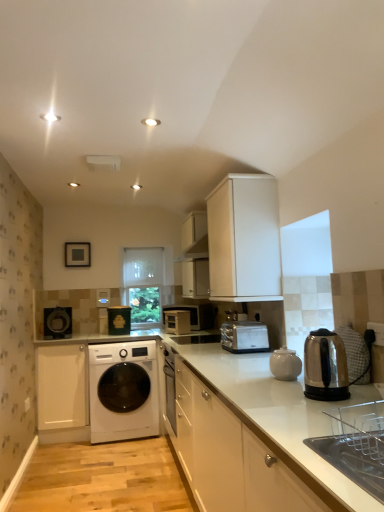
You are a GUI agent. You are given a task and a screenshot of the screen. Output one action in this format:
    pyautogui.click(x=<x>, y=<y>)
    Task: Click on the white matte cabinet at lower left, the 4th cabinetry from the right
    Image resolution: width=384 pixels, height=512 pixels.
    Given the screenshot: What is the action you would take?
    pyautogui.click(x=61, y=386)

The height and width of the screenshot is (512, 384). Describe the element at coordinates (119, 320) in the screenshot. I see `matte black toaster at center, which is the 2th appliance from right to left` at that location.

Describe the element at coordinates (177, 322) in the screenshot. Image resolution: width=384 pixels, height=512 pixels. I see `metallic silver toaster at center, which is counted as the 3th appliance, starting from the left` at that location.

Where is `white glossy washing machine at lower left`? white glossy washing machine at lower left is located at coordinates (123, 391).

The height and width of the screenshot is (512, 384). I want to click on white matte cabinet at lower left, the 4th cabinetry from the right, so click(x=61, y=386).

Between point (146, 248) and point (227, 327), which one is positioned in front?

The point (227, 327) is in front.

From the image's perspective, is transparent plastic window screen at center, placed as the first window screen when sorted from top to bottom, positioned above or below satin silver toaster at center, which appears as the first home appliance when viewed from the back?

Clearly, from the image's perspective, transparent plastic window screen at center, placed as the first window screen when sorted from top to bottom, is above satin silver toaster at center, which appears as the first home appliance when viewed from the back.

From the image's perspective, count 2nd window screens upward from the satin silver toaster at center, the 2th home appliance when ordered from front to back, and point to it. Please provide its 2D coordinates.

[(143, 266)]

Considering the relative positions of transparent plastic window screen at center, the 2th window screen in the bottom-to-top sequence, and satin silver toaster at center, the 2th home appliance when ordered from front to back, in the image provided, is transparent plastic window screen at center, the 2th window screen in the bottom-to-top sequence, to the left of satin silver toaster at center, the 2th home appliance when ordered from front to back, from the viewer's perspective?

Correct, you'll find transparent plastic window screen at center, the 2th window screen in the bottom-to-top sequence, to the left of satin silver toaster at center, the 2th home appliance when ordered from front to back.

In the image, is transparent glass window at center, placed as the 1th window screen when sorted from bottom to top, on the left side or the right side of white glossy cabinet at center, placed as the 2th cabinetry when sorted from left to right?

In the image, transparent glass window at center, placed as the 1th window screen when sorted from bottom to top, appears on the left side of white glossy cabinet at center, placed as the 2th cabinetry when sorted from left to right.

Does point (149, 307) come farther from viewer compared to point (196, 497)?

That is True.

How much distance is there between transparent glass window at center, placed as the 1th window screen when sorted from bottom to top, and white glossy cabinet at center, placed as the 2th cabinetry when sorted from left to right?

2.61 meters.

Is matte black toaster at center, which is the 2th appliance from right to left, bigger or smaller than transparent glass window at center, which is the 2th window screen in top-to-bottom order?

Considering their sizes, matte black toaster at center, which is the 2th appliance from right to left, takes up less space than transparent glass window at center, which is the 2th window screen in top-to-bottom order.

Which is less distant, (116, 331) or (138, 250)?

Clearly, point (116, 331) is closer to the camera than point (138, 250).

Is matte black toaster at center, which is the 2th appliance from right to left, wider than transparent glass window at center, placed as the 1th window screen when sorted from bottom to top?

Yes, matte black toaster at center, which is the 2th appliance from right to left, is wider than transparent glass window at center, placed as the 1th window screen when sorted from bottom to top.

From a real-world perspective, does matte black toaster at center, the 2th appliance when ordered from left to right, stand above transparent glass window at center, which is the 2th window screen in top-to-bottom order?

No, from a real-world perspective, matte black toaster at center, the 2th appliance when ordered from left to right, is not above transparent glass window at center, which is the 2th window screen in top-to-bottom order.

Based on the photo, can you confirm if metallic silver toaster at center, the 1th appliance viewed from the right, is bigger than white glossy teapot at center?

Yes, metallic silver toaster at center, the 1th appliance viewed from the right, is bigger than white glossy teapot at center.

Based on their positions, is metallic silver toaster at center, which is counted as the 3th appliance, starting from the left, located to the left or right of white glossy teapot at center?

metallic silver toaster at center, which is counted as the 3th appliance, starting from the left, is to the left of white glossy teapot at center.

Considering the positions of points (167, 316) and (283, 349), is point (167, 316) farther from camera compared to point (283, 349)?

Yes, point (167, 316) is behind point (283, 349).

Can white glossy teapot at center be found inside metallic silver toaster at center, which is counted as the 3th appliance, starting from the left?

No, white glossy teapot at center is not a part of metallic silver toaster at center, which is counted as the 3th appliance, starting from the left.

Is stainless steel kettle at right, which appears as the second home appliance when viewed from the back, smaller than white matte cabinet at lower left, the 1th cabinetry viewed from the left?

Correct, stainless steel kettle at right, which appears as the second home appliance when viewed from the back, occupies less space than white matte cabinet at lower left, the 1th cabinetry viewed from the left.

How many degrees apart are the facing directions of stainless steel kettle at right, which appears as the second home appliance when viewed from the back, and white matte cabinet at lower left, the 1th cabinetry viewed from the left?

88.7 degrees separate the facing orientations of stainless steel kettle at right, which appears as the second home appliance when viewed from the back, and white matte cabinet at lower left, the 1th cabinetry viewed from the left.

Considering the relative sizes of stainless steel kettle at right, which appears as the second home appliance when viewed from the back, and white matte cabinet at lower left, the 1th cabinetry viewed from the left, in the image provided, is stainless steel kettle at right, which appears as the second home appliance when viewed from the back, thinner than white matte cabinet at lower left, the 1th cabinetry viewed from the left,?

Yes.

Are stainless steel kettle at right, which appears as the second home appliance when viewed from the back, and white matte cabinet at lower left, the 1th cabinetry viewed from the left, making contact?

stainless steel kettle at right, which appears as the second home appliance when viewed from the back, and white matte cabinet at lower left, the 1th cabinetry viewed from the left, are clearly separated.

Considering the relative sizes of white glossy cabinet at center, which is the first cabinetry from right to left, and white glossy cabinet at center, placed as the 2th cabinetry when sorted from left to right, in the image provided, is white glossy cabinet at center, which is the first cabinetry from right to left, smaller than white glossy cabinet at center, placed as the 2th cabinetry when sorted from left to right,?

Actually, white glossy cabinet at center, which is the first cabinetry from right to left, might be larger than white glossy cabinet at center, placed as the 2th cabinetry when sorted from left to right.

From the image's perspective, between white glossy cabinet at center, the fourth cabinetry when ordered from left to right, and white glossy cabinet at center, placed as the 2th cabinetry when sorted from left to right, which one is located above?

white glossy cabinet at center, the fourth cabinetry when ordered from left to right, from the image's perspective.

From the image's perspective, which is below, white matte cabinet at lower left, the 4th cabinetry from the right, or white matte cabinet at upper center, the 2th cabinetry from the right?

white matte cabinet at lower left, the 4th cabinetry from the right, is shown below in the image.

Which object is thinner, white matte cabinet at lower left, the 1th cabinetry viewed from the left, or white matte cabinet at upper center, the 2th cabinetry from the right?

white matte cabinet at upper center, the 2th cabinetry from the right, is thinner.

From the white matte cabinet at upper center, which is the third cabinetry from left to right, count the 2nd cabinetry to the left and point to it. Please provide its 2D coordinates.

[(61, 386)]

Which of these two, white matte cabinet at lower left, the 1th cabinetry viewed from the left, or white matte cabinet at upper center, which is the third cabinetry from left to right, stands shorter?

white matte cabinet at upper center, which is the third cabinetry from left to right, is shorter.

Starting from the satin silver toaster at center, which appears as the first home appliance when viewed from the back, which window screen is the 2nd one to the left? Please provide its 2D coordinates.

[(143, 266)]

From a real-world perspective, count 2nd cabinetrys downward from the transparent glass window at center, which is the 2th window screen in top-to-bottom order, and point to it. Please provide its 2D coordinates.

[(214, 448)]

Considering their positions, is stainless steel kettle at right, which ranks as the first home appliance in front-to-back order, positioned closer to satin silver toaster at center, which appears as the first home appliance when viewed from the back, than white matte cabinet at lower left, the 4th cabinetry from the right?

stainless steel kettle at right, which ranks as the first home appliance in front-to-back order, is closer to satin silver toaster at center, which appears as the first home appliance when viewed from the back.

Considering their positions, is white glossy teapot at center positioned closer to matte black toaster at center, which is the 2th appliance from right to left, than metallic silver toaster at center, which is counted as the 3th appliance, starting from the left?

metallic silver toaster at center, which is counted as the 3th appliance, starting from the left, is closer to matte black toaster at center, which is the 2th appliance from right to left.

From the image, which object appears to be farther from matte black toaster at center, the 2th appliance when ordered from left to right, white glossy washing machine at lower left or transparent glass window at center, placed as the 1th window screen when sorted from bottom to top?

Based on the image, white glossy washing machine at lower left appears to be further to matte black toaster at center, the 2th appliance when ordered from left to right.

Estimate the real-world distances between objects in this image. Which object is further from white glossy washing machine at lower left, white glossy cabinet at center, placed as the 2th cabinetry when sorted from left to right, or stainless steel kettle at right, which appears as the second home appliance when viewed from the back?

stainless steel kettle at right, which appears as the second home appliance when viewed from the back, is positioned further to the anchor white glossy washing machine at lower left.

Based on their spatial positions, is white glossy cabinet at center, the fourth cabinetry when ordered from left to right, or white matte cabinet at lower left, the 1th cabinetry viewed from the left, further from stainless steel kettle at right, which appears as the second home appliance when viewed from the back?

The object further to stainless steel kettle at right, which appears as the second home appliance when viewed from the back, is white matte cabinet at lower left, the 1th cabinetry viewed from the left.

Considering their positions, is white glossy washing machine at lower left positioned further to white matte cabinet at lower left, the 1th cabinetry viewed from the left, than white glossy cabinet at center, which is the third cabinetry in right-to-left order?

Among the two, white glossy cabinet at center, which is the third cabinetry in right-to-left order, is located further to white matte cabinet at lower left, the 1th cabinetry viewed from the left.

From the image, which object appears to be nearer to satin silver toaster at center, the 2th home appliance when ordered from front to back, white matte cabinet at upper center, the 2th cabinetry from the right, or transparent plastic window screen at center, the 2th window screen in the bottom-to-top sequence?

white matte cabinet at upper center, the 2th cabinetry from the right, is positioned closer to the anchor satin silver toaster at center, the 2th home appliance when ordered from front to back.

Which object lies nearer to the anchor point white glossy teapot at center, white glossy cabinet at center, the fourth cabinetry when ordered from left to right, or white matte cabinet at upper center, the 2th cabinetry from the right?

Based on the image, white glossy cabinet at center, the fourth cabinetry when ordered from left to right, appears to be nearer to white glossy teapot at center.

At what (x,y) coordinates should I click in order to perform the action: click on washing machine between white glossy teapot at center and matte black toaster at center, which is the 2th appliance from right to left, along the z-axis. Please return your answer as a coordinate pair (x, y). The image size is (384, 512). Looking at the image, I should click on (123, 391).

What are the coordinates of `kitchen appliance between white glossy cabinet at center, the fourth cabinetry when ordered from left to right, and white glossy cabinet at center, placed as the 2th cabinetry when sorted from left to right, along the z-axis` in the screenshot? It's located at (285, 364).

Locate an element on the screen. The height and width of the screenshot is (512, 384). cabinetry between matte black washing machine at left, which is the third appliance in right-to-left order, and white glossy cabinet at center, which is the third cabinetry in right-to-left order, in the horizontal direction is located at coordinates (61, 386).

Where is `washing machine located between white glossy cabinet at center, the fourth cabinetry when ordered from left to right, and metallic silver toaster at center, which is counted as the 3th appliance, starting from the left, in the depth direction`? This screenshot has height=512, width=384. washing machine located between white glossy cabinet at center, the fourth cabinetry when ordered from left to right, and metallic silver toaster at center, which is counted as the 3th appliance, starting from the left, in the depth direction is located at coordinates (123, 391).